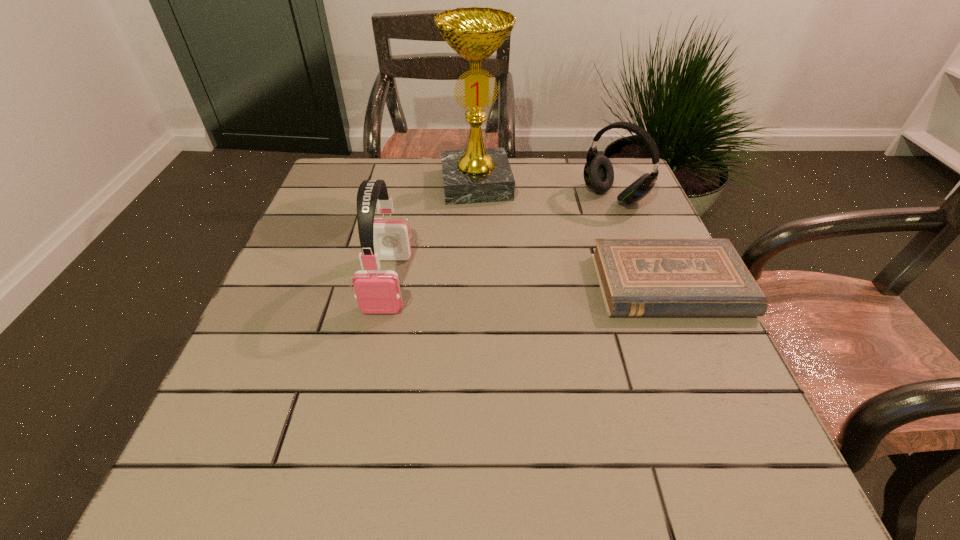
Locate an element on the screen. The height and width of the screenshot is (540, 960). free spot between the Bible and the tallest object is located at coordinates (573, 235).

Identify the location of unoccupied position between the tallest object and the third shortest object. (432, 233).

The width and height of the screenshot is (960, 540). What are the coordinates of `empty location between the leftmost object and the second shortest object` in the screenshot? It's located at (501, 240).

In order to click on free space between the leftmost object and the shortest object in this screenshot , I will do `click(529, 284)`.

The image size is (960, 540). Identify the location of vacant area between the award and the shortest object. (573, 235).

The image size is (960, 540). Find the location of `object that ranks as the closest to the leftmost object`. object that ranks as the closest to the leftmost object is located at coordinates (477, 174).

Where is `object that is the third nearest to the headset`? The width and height of the screenshot is (960, 540). object that is the third nearest to the headset is located at coordinates (377, 291).